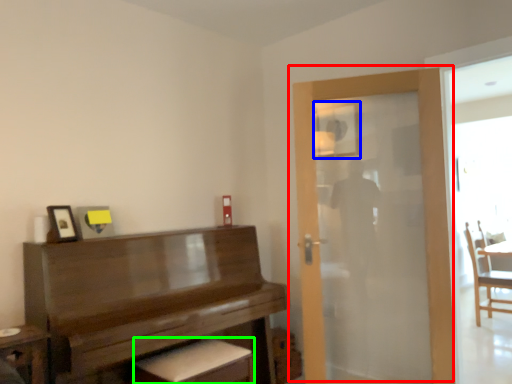
Question: Which object is positioned farthest from door (highlighted by a red box)? Select from mirror (highlighted by a blue box) and footrest (highlighted by a green box).

Choices:
 (A) mirror
 (B) footrest

Answer: (B)